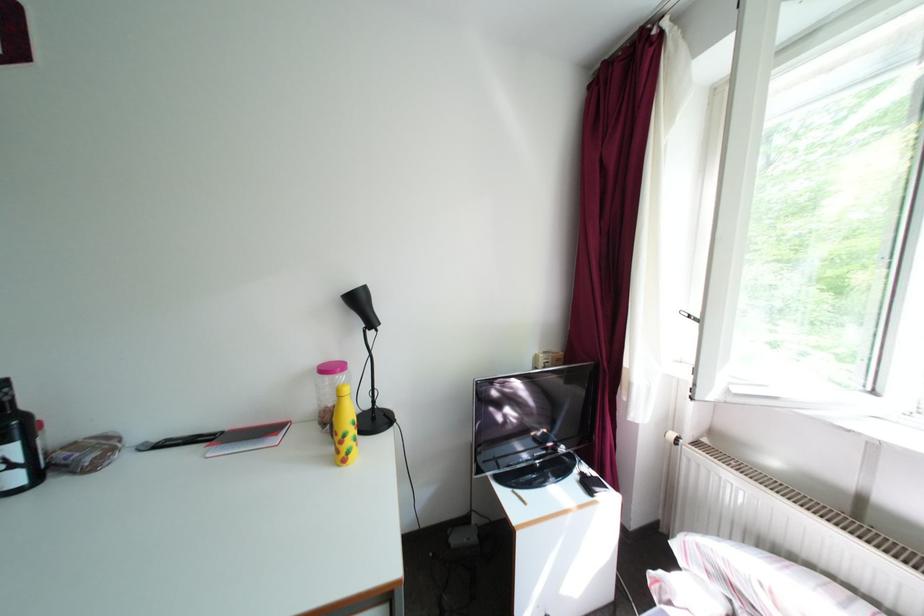
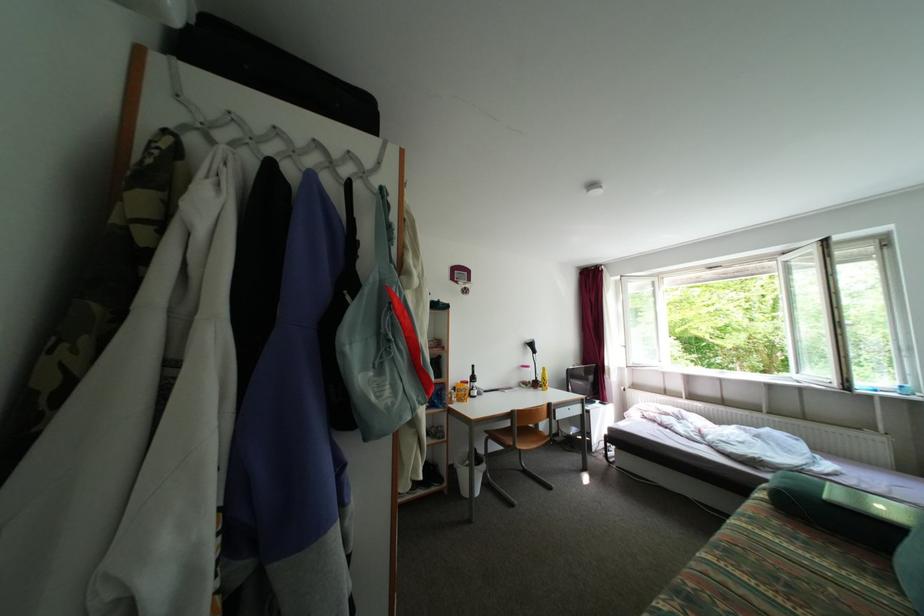
The images are taken continuously from a first-person perspective. In which direction are you moving?

The movement direction of the cameraman is left, backward.